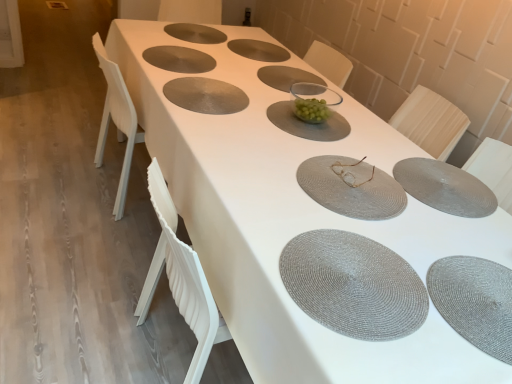
You are a GUI agent. You are given a task and a screenshot of the screen. Output one action in this format:
    pyautogui.click(x=<x>, y=<y>)
    Task: Click on the vacant region to the left of gray woven placemat at center, the 2th tableware in the bottom-to-top sequence
    This screenshot has height=384, width=512.
    Given the screenshot: What is the action you would take?
    pyautogui.click(x=348, y=141)